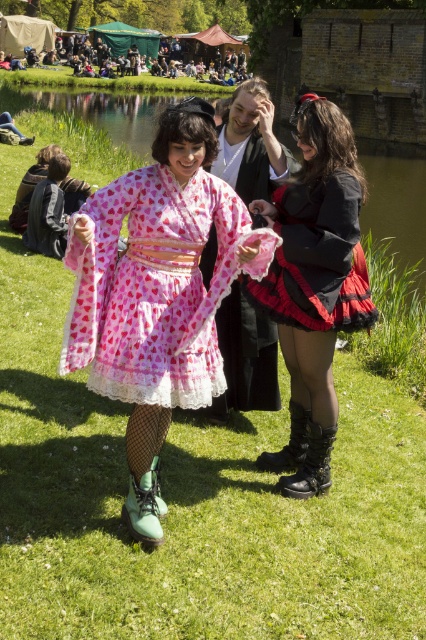
Does black leather boots at center have a greater height compared to green matte boots at center?

Yes, black leather boots at center is taller than green matte boots at center.

Measure the distance between point [308,412] and camera.

The distance of point [308,412] from camera is 4.24 meters.

What are the coordinates of `black leather boots at center` in the screenshot? It's located at (314, 285).

Is point (78, 328) positioned behind point (339, 300)?

No, it is not.

Does point (222, 202) come farther from viewer compared to point (348, 202)?

That is False.

This screenshot has height=640, width=426. In order to click on pink lace dress at center in this screenshot , I will do `click(155, 285)`.

Can you confirm if matte black dress at center is smaller than green matte boots at center?

No, matte black dress at center is not smaller than green matte boots at center.

In the scene shown: Can you confirm if matte black dress at center is positioned to the left of green matte boots at center?

Correct, you'll find matte black dress at center to the left of green matte boots at center.

Measure the distance between matte black dress at center and camera.

matte black dress at center and camera are 3.67 meters apart from each other.

You are a GUI agent. You are given a task and a screenshot of the screen. Output one action in this format:
    pyautogui.click(x=<x>, y=<y>)
    Task: Click on the matte black dress at center
    
    Given the screenshot: What is the action you would take?
    pyautogui.click(x=316, y=259)